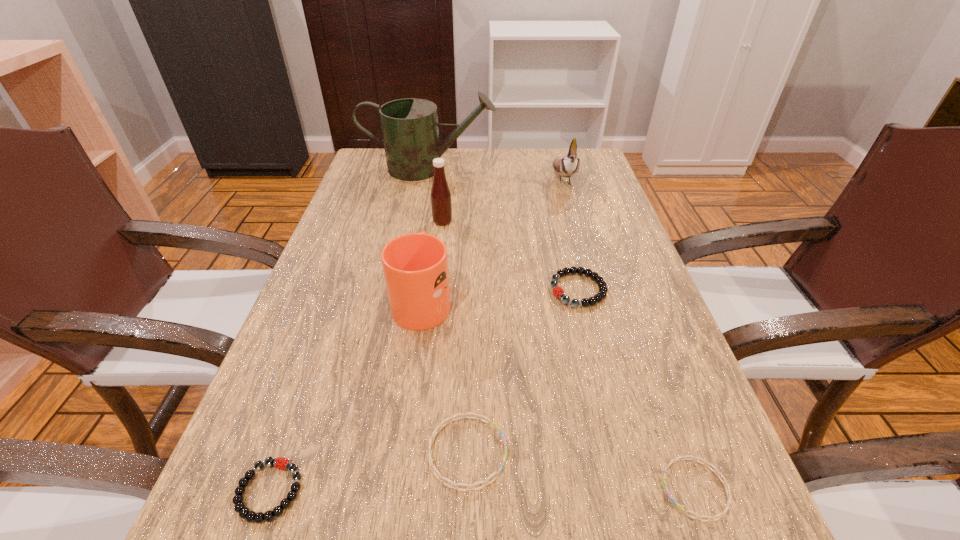
Where is `bird located in the right edge section of the desktop`? bird located in the right edge section of the desktop is located at coordinates (566, 166).

Locate an element on the screen. object that is positioned at the far left corner is located at coordinates (410, 131).

Image resolution: width=960 pixels, height=540 pixels. Find the location of `object present at the far right corner`. object present at the far right corner is located at coordinates (566, 166).

Where is `blank space at the far edge of the desktop`? blank space at the far edge of the desktop is located at coordinates (533, 183).

Find the location of a particular element. The height and width of the screenshot is (540, 960). vacant area at the left edge is located at coordinates (385, 217).

In the image, there is a desktop. Identify the location of vacant space at the right edge. (622, 251).

At what (x,y) coordinates should I click in order to perform the action: click on vacant space at the far left corner of the desktop. Please return your answer as a coordinate pair (x, y). This screenshot has width=960, height=540. Looking at the image, I should click on (371, 172).

Where is `vacant space at the far right corner`? The height and width of the screenshot is (540, 960). vacant space at the far right corner is located at coordinates (564, 181).

At what (x,y) coordinates should I click in order to perform the action: click on free spot between the shortest object and the fifth tallest object. Please return your answer as a coordinate pair (x, y). Image resolution: width=960 pixels, height=540 pixels. Looking at the image, I should click on (636, 389).

Identify the location of vacant space in between the nearer black bracelet and the watering can. (349, 329).